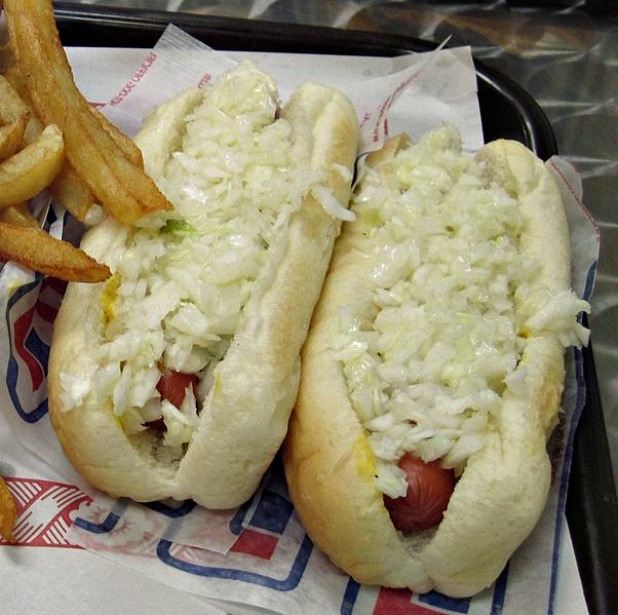
Where is `glass table/surface`? glass table/surface is located at coordinates (573, 65).